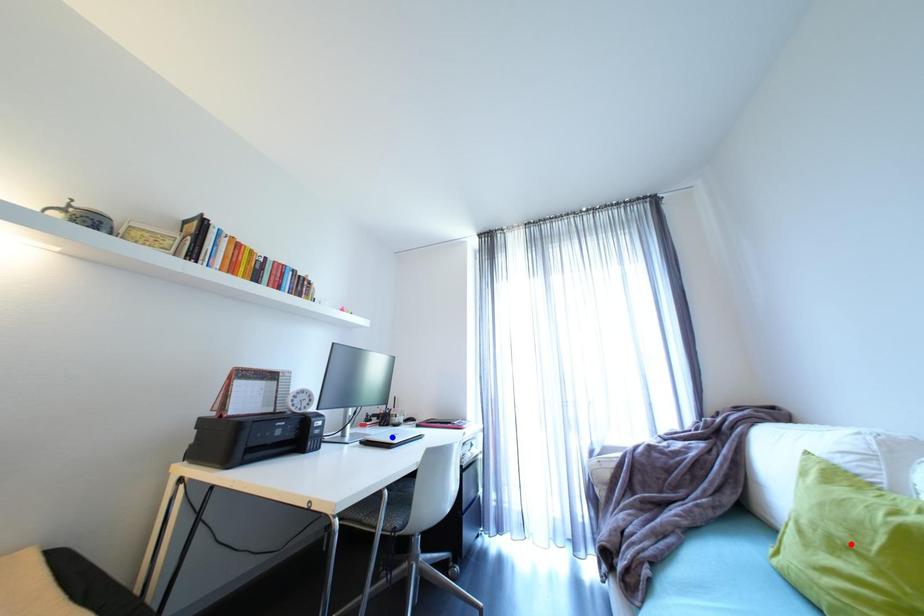
Question: In the image, two points are highlighted. Which point is nearer to the camera? Reply with the corresponding letter.

Choices:
 (A) blue point
 (B) red point

Answer: (B)